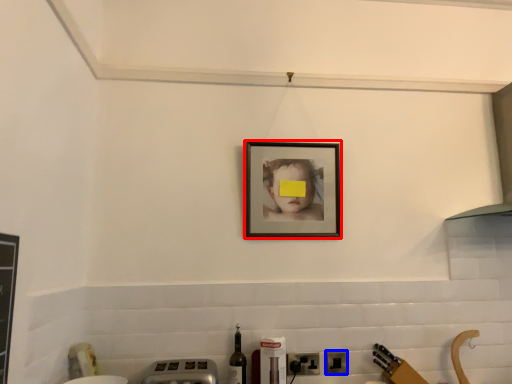
Question: Which object is further to the camera taking this photo, picture frame (highlighted by a red box) or electric outlet (highlighted by a blue box)?

Choices:
 (A) picture frame
 (B) electric outlet

Answer: (A)